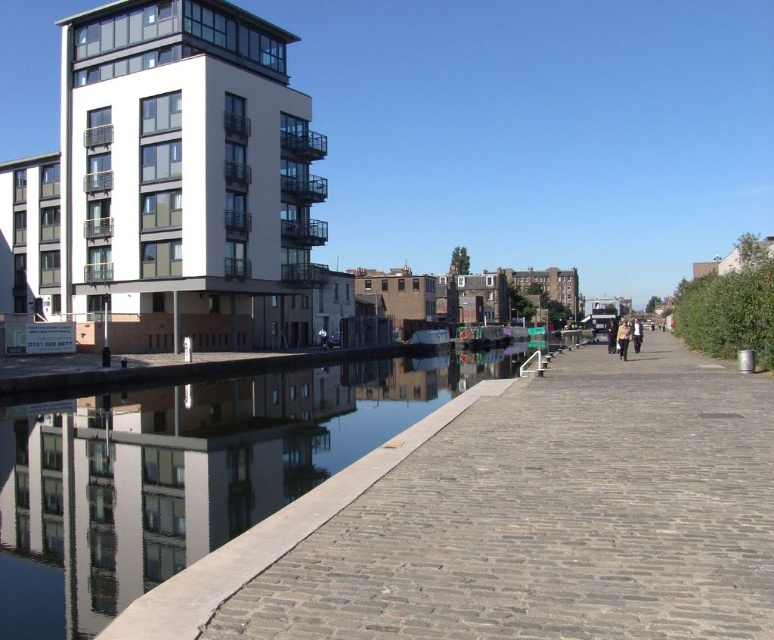
Can you confirm if brown leather jacket at center is positioned above light brown leather jacket at center-right?

Incorrect, brown leather jacket at center is not positioned above light brown leather jacket at center-right.

Is point (622, 342) positioned before point (639, 321)?

Yes.

Who is more forward, (622,340) or (632,344)?

Point (622,340) is in front.

The image size is (774, 640). In order to click on brown leather jacket at center in this screenshot , I will do `click(622, 339)`.

Which is more to the right, brown leather jacket at center or dark blue jeans at center?

From the viewer's perspective, dark blue jeans at center appears more on the right side.

Locate an element on the screen. This screenshot has width=774, height=640. brown leather jacket at center is located at coordinates (622, 339).

Find the location of a particular element. brown leather jacket at center is located at coordinates (622, 339).

Does light brown leather jacket at center-right have a lesser width compared to dark blue jeans at center?

Incorrect, light brown leather jacket at center-right's width is not less than dark blue jeans at center's.

The width and height of the screenshot is (774, 640). In order to click on light brown leather jacket at center-right in this screenshot , I will do `click(636, 333)`.